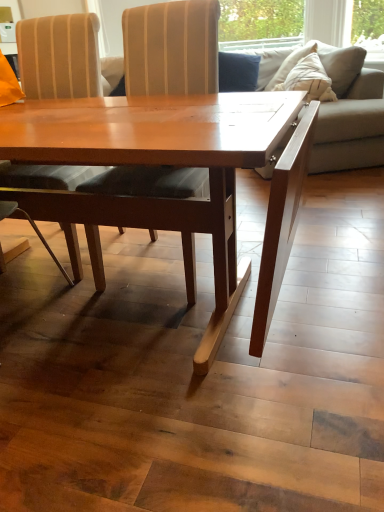
Identify the location of free location in front of wooden striped chair at center, arranged as the 1th chair when viewed from the right. This screenshot has width=384, height=512. (152, 337).